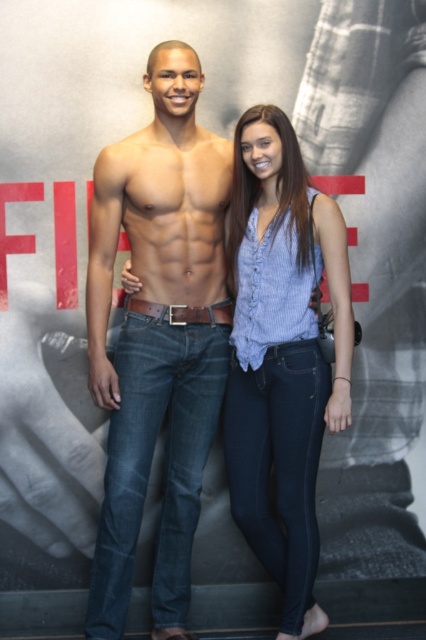
From the picture: You are a photographer adjusting the camera focus. The camera is set to focus on the matte black torso at center. Based on the coordinates provided, will the focus point align with the torso?

The matte black torso at center is located at point (158, 337), so yes, the focus point will align with the torso as it is centered at those coordinates.

Based on the scene description, which object is larger in size between the matte black torso at center and the blue denim jeans at center?

The matte black torso at center is bigger than blue denim jeans at center according to the description.